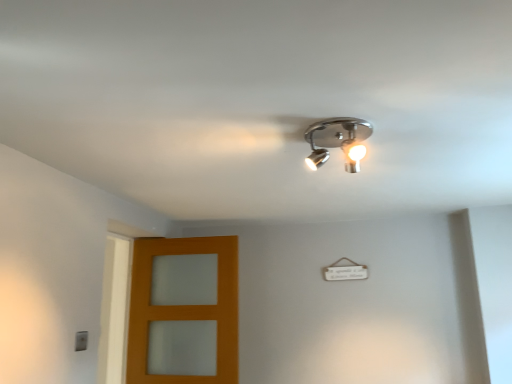
Locate an element on the screen. Image resolution: width=512 pixels, height=384 pixels. chrome/metallic spotlight at upper center is located at coordinates (338, 141).

What do you see at coordinates (338, 141) in the screenshot? I see `chrome/metallic spotlight at upper center` at bounding box center [338, 141].

Describe the element at coordinates (184, 310) in the screenshot. I see `orange wood door at lower left` at that location.

Where is `orange wood door at lower left`? The height and width of the screenshot is (384, 512). orange wood door at lower left is located at coordinates (184, 310).

What is the approximate width of orange wood door at lower left?

orange wood door at lower left is 6.44 inches in width.

Identify the location of chrome/metallic spotlight at upper center. (338, 141).

Does chrome/metallic spotlight at upper center appear on the left side of orange wood door at lower left?

Incorrect, chrome/metallic spotlight at upper center is not on the left side of orange wood door at lower left.

Is chrome/metallic spotlight at upper center positioned before orange wood door at lower left?

Yes, it is in front of orange wood door at lower left.

Which is behind, point (351, 136) or point (182, 328)?

The point (182, 328) is behind.

From the image's perspective, relative to orange wood door at lower left, is chrome/metallic spotlight at upper center above or below?

Clearly, from the image's perspective, chrome/metallic spotlight at upper center is above orange wood door at lower left.

From a real-world perspective, between chrome/metallic spotlight at upper center and orange wood door at lower left, who is vertically lower?

In real-world perspective, orange wood door at lower left is lower.

Which object is thinner, chrome/metallic spotlight at upper center or orange wood door at lower left?

orange wood door at lower left is thinner.

Considering the sizes of objects chrome/metallic spotlight at upper center and orange wood door at lower left in the image provided, who is shorter, chrome/metallic spotlight at upper center or orange wood door at lower left?

Standing shorter between the two is chrome/metallic spotlight at upper center.

Who is smaller, chrome/metallic spotlight at upper center or orange wood door at lower left?

With smaller size is chrome/metallic spotlight at upper center.

Can we say chrome/metallic spotlight at upper center lies outside orange wood door at lower left?

Yes, chrome/metallic spotlight at upper center is not within orange wood door at lower left.

In the scene shown: Is chrome/metallic spotlight at upper center placed right next to orange wood door at lower left?

No.

Is chrome/metallic spotlight at upper center facing towards orange wood door at lower left?

No, chrome/metallic spotlight at upper center is not oriented towards orange wood door at lower left.

Can you tell me how much chrome/metallic spotlight at upper center and orange wood door at lower left differ in facing direction?

The angle between the facing direction of chrome/metallic spotlight at upper center and the facing direction of orange wood door at lower left is 89.6 degrees.

How far apart are chrome/metallic spotlight at upper center and orange wood door at lower left?

chrome/metallic spotlight at upper center and orange wood door at lower left are 1.52 meters apart.

You are a GUI agent. You are given a task and a screenshot of the screen. Output one action in this format:
    pyautogui.click(x=<x>, y=<y>)
    Task: Click on the door that is behind the chrome/metallic spotlight at upper center
    The height and width of the screenshot is (384, 512).
    Given the screenshot: What is the action you would take?
    pyautogui.click(x=184, y=310)

Considering the relative positions of orange wood door at lower left and chrome/metallic spotlight at upper center in the image provided, is orange wood door at lower left to the left or to the right of chrome/metallic spotlight at upper center?

orange wood door at lower left is to the left of chrome/metallic spotlight at upper center.

Is orange wood door at lower left positioned in front of chrome/metallic spotlight at upper center?

No.

Between point (149, 286) and point (345, 137), which one is positioned behind?

The point (149, 286) is farther.

From the image's perspective, which one is positioned higher, orange wood door at lower left or chrome/metallic spotlight at upper center?

chrome/metallic spotlight at upper center, from the image's perspective.

From a real-world perspective, which is physically below, orange wood door at lower left or chrome/metallic spotlight at upper center?

From a 3D spatial view, orange wood door at lower left is below.

Considering the relative sizes of orange wood door at lower left and chrome/metallic spotlight at upper center in the image provided, is orange wood door at lower left wider than chrome/metallic spotlight at upper center?

In fact, orange wood door at lower left might be narrower than chrome/metallic spotlight at upper center.

Between orange wood door at lower left and chrome/metallic spotlight at upper center, which one has less height?

Standing shorter between the two is chrome/metallic spotlight at upper center.

Considering the sizes of objects orange wood door at lower left and chrome/metallic spotlight at upper center in the image provided, who is smaller, orange wood door at lower left or chrome/metallic spotlight at upper center?

Smaller between the two is chrome/metallic spotlight at upper center.

Could chrome/metallic spotlight at upper center be considered to be inside orange wood door at lower left?

That's incorrect, chrome/metallic spotlight at upper center is not inside orange wood door at lower left.

Are orange wood door at lower left and chrome/metallic spotlight at upper center far apart?

Yes, orange wood door at lower left and chrome/metallic spotlight at upper center are quite far apart.

Is chrome/metallic spotlight at upper center at the back of orange wood door at lower left?

No, orange wood door at lower left is not facing the opposite direction of chrome/metallic spotlight at upper center.

Measure the distance from orange wood door at lower left to chrome/metallic spotlight at upper center.

A distance of 1.52 meters exists between orange wood door at lower left and chrome/metallic spotlight at upper center.

At what (x,y) coordinates should I click in order to perform the action: click on door lying below the chrome/metallic spotlight at upper center (from the image's perspective). Please return your answer as a coordinate pair (x, y). The width and height of the screenshot is (512, 384). Looking at the image, I should click on (184, 310).

Locate an element on the screen. lamp in front of the orange wood door at lower left is located at coordinates (338, 141).

I want to click on lamp lying above the orange wood door at lower left (from the image's perspective), so click(x=338, y=141).